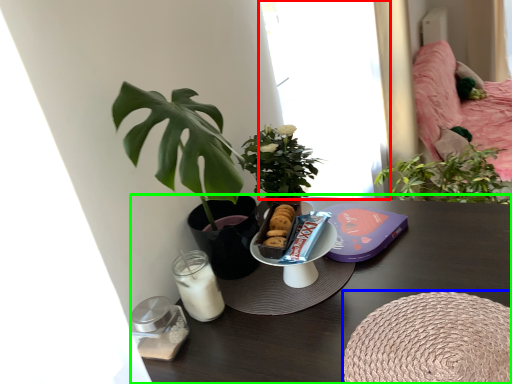
Question: Which object is positioned farthest from window (highlighted by a red box)? Select from round table (highlighted by a blue box) and table (highlighted by a green box).

Choices:
 (A) round table
 (B) table

Answer: (A)